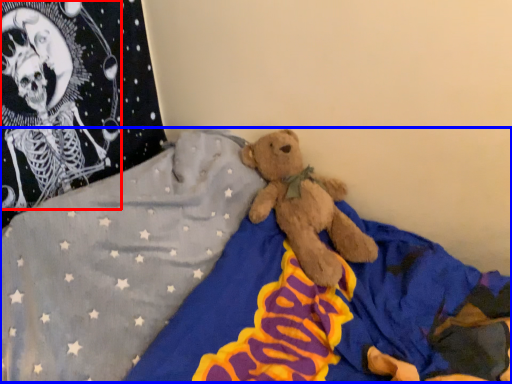
Question: Which object appears farthest to the camera in this image, toy (highlighted by a red box) or bed (highlighted by a blue box)?

Choices:
 (A) toy
 (B) bed

Answer: (A)